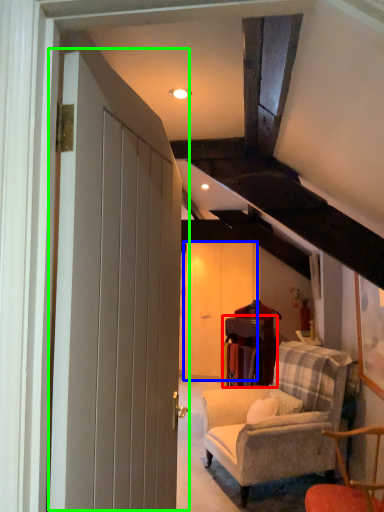
Question: Which object is positioned farthest from table (highlighted by a red box)? Select from barn door (highlighted by a blue box) and door (highlighted by a green box).

Choices:
 (A) barn door
 (B) door

Answer: (B)